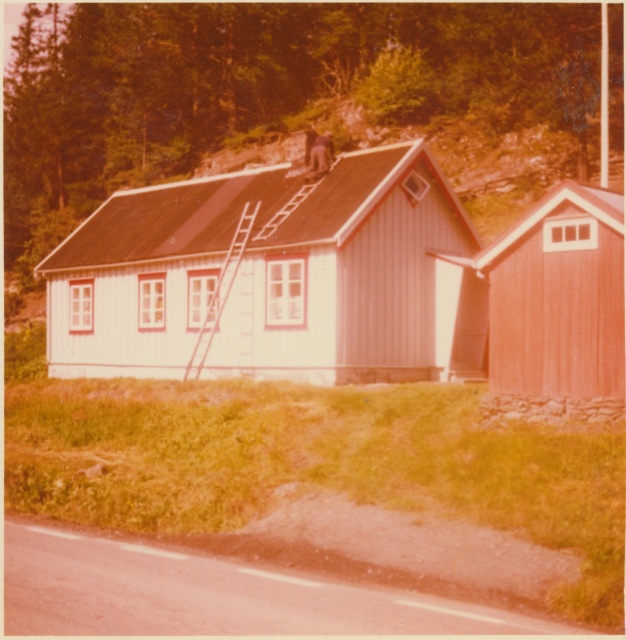
Question: From the image, what is the correct spatial relationship of white wooden hut at center in relation to smooth wooden shed at right?

Choices:
 (A) above
 (B) below

Answer: (A)

Question: Which of the following is the closest to the observer?

Choices:
 (A) (510, 337)
 (B) (357, 285)

Answer: (A)

Question: Among these points, which one is nearest to the camera?

Choices:
 (A) (613, 406)
 (B) (182, 188)
 (C) (212, 330)

Answer: (A)

Question: Is white wooden hut at center thinner than smooth wooden shed at right?

Choices:
 (A) yes
 (B) no

Answer: (B)

Question: Observing the image, what is the correct spatial positioning of smooth wooden shed at right in reference to metallic ladder at center?

Choices:
 (A) left
 (B) right

Answer: (B)

Question: Which is nearer to the smooth wooden shed at right?

Choices:
 (A) metallic ladder at center
 (B) white wooden hut at center

Answer: (A)